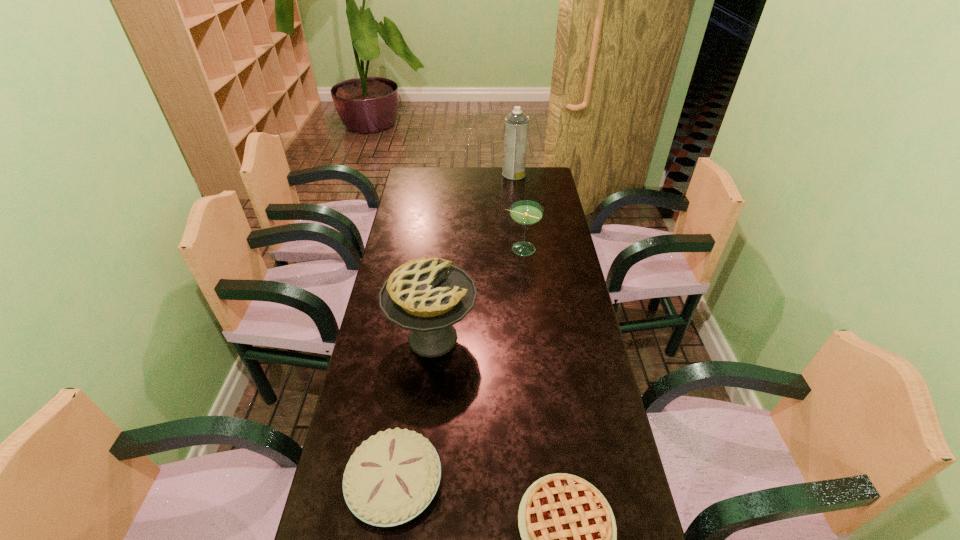
Identify the location of object that is the fourth closest to the second tallest pie. (516, 124).

Locate an element on the screen. The height and width of the screenshot is (540, 960). pie that is the second closest to the shortest object is located at coordinates (428, 296).

Locate which pie ranks in proximity to the rightmost pie. Please provide its 2D coordinates. Your answer should be formatted as a tuple, i.e. [(x, y)], where the tuple contains the x and y coordinates of a point satisfying the conditions above.

[(392, 477)]

Find the location of a particular element. free point that satisfies the following two spatial constraints: 1. on the front side of the farthest object; 2. on the cut side of the farthest pie is located at coordinates (533, 338).